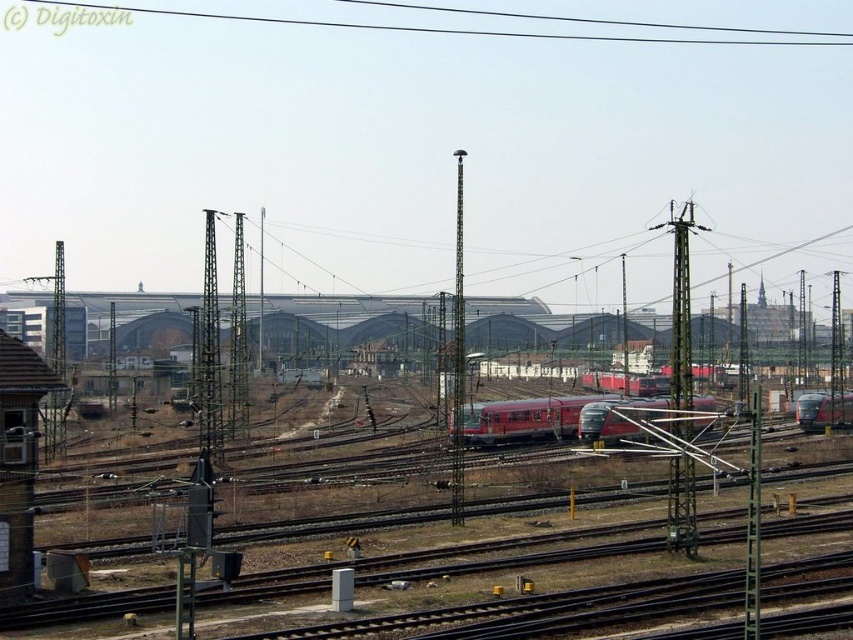
Question: Observing the image, what is the correct spatial positioning of red metallic train at center in reference to metallic pole at center?

Choices:
 (A) above
 (B) below

Answer: (B)

Question: Which point is closer to the camera?

Choices:
 (A) (587, 435)
 (B) (462, 365)
 (C) (816, 424)

Answer: (B)

Question: Does metallic pole at center come behind red metallic train at right?

Choices:
 (A) yes
 (B) no

Answer: (B)

Question: Which point is farther to the camera?

Choices:
 (A) metallic pole at center
 (B) red metallic train at center
 (C) red metallic train at right
 (D) black wire at upper center

Answer: (D)

Question: Where is metallic pole at center located in relation to red metallic train at right in the image?

Choices:
 (A) left
 (B) right

Answer: (A)

Question: Considering the real-world distances, which object is farthest from the red metallic train at center?

Choices:
 (A) metallic pole at center
 (B) red metallic train at right

Answer: (B)